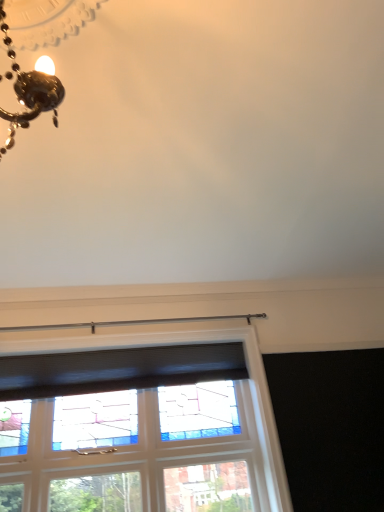
Question: In terms of size, does black mesh curtain at upper center appear bigger or smaller than stained glass window at center?

Choices:
 (A) small
 (B) big

Answer: (A)

Question: In terms of width, does black mesh curtain at upper center look wider or thinner when compared to stained glass window at center?

Choices:
 (A) wide
 (B) thin

Answer: (B)

Question: Is black mesh curtain at upper center to the left or to the right of stained glass window at center in the image?

Choices:
 (A) right
 (B) left

Answer: (B)

Question: In terms of width, does stained glass window at center look wider or thinner when compared to black mesh curtain at upper center?

Choices:
 (A) thin
 (B) wide

Answer: (B)

Question: Looking at the image, does stained glass window at center seem bigger or smaller compared to black mesh curtain at upper center?

Choices:
 (A) small
 (B) big

Answer: (B)

Question: Considering the positions of stained glass window at center and black mesh curtain at upper center in the image, is stained glass window at center taller or shorter than black mesh curtain at upper center?

Choices:
 (A) tall
 (B) short

Answer: (A)

Question: From the image's perspective, is stained glass window at center located above or below black mesh curtain at upper center?

Choices:
 (A) below
 (B) above

Answer: (A)